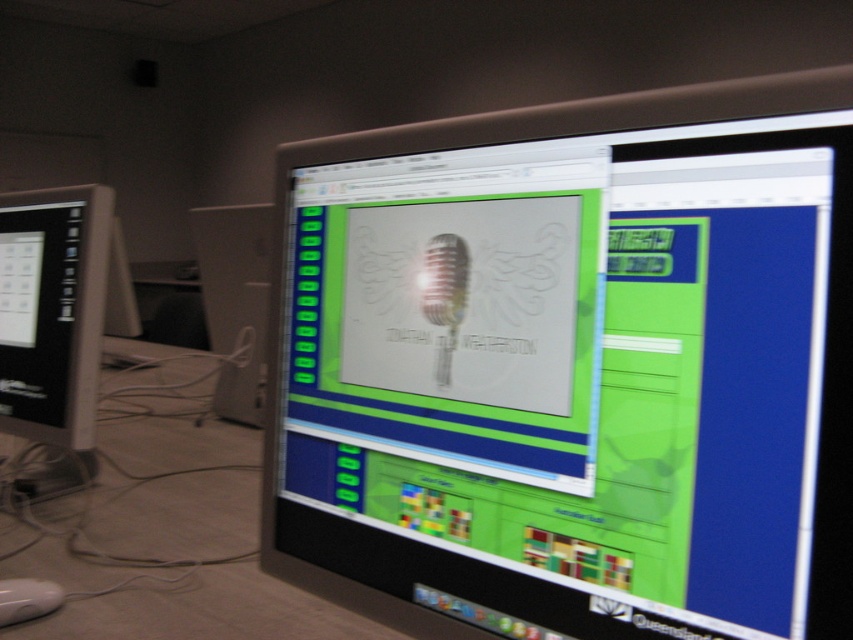
You are a graphic designer working on a project. You have two matte black monitors in your workspace. The matte black monitor at center and the matte black monitor at left. You need to place a large design file that requires more horizontal space. Which monitor would be better suited for this task?

The matte black monitor at center has a greater width than the matte black monitor at left, so it would be better suited for placing the large design file that requires more horizontal space.